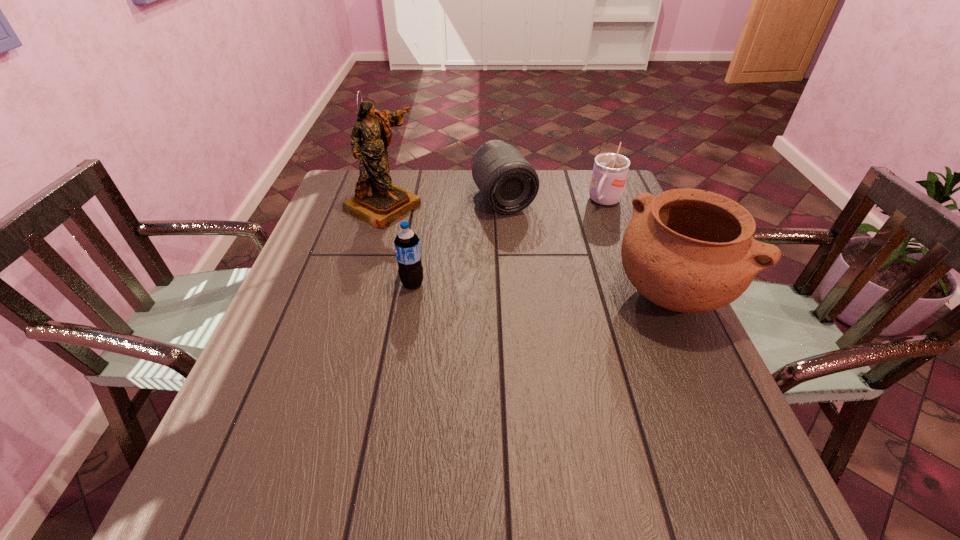
Identify the location of free space that satisfies the following two spatial constraints: 1. on the back side of the tallest object; 2. on the left side of the cup. click(384, 202).

Identify the location of vacant position in the image that satisfies the following two spatial constraints: 1. on the back side of the soda bottle; 2. on the right side of the cup. (426, 202).

Locate an element on the screen. The height and width of the screenshot is (540, 960). vacant region that satisfies the following two spatial constraints: 1. on the front side of the pottery; 2. on the left side of the third object from right to left is located at coordinates (510, 294).